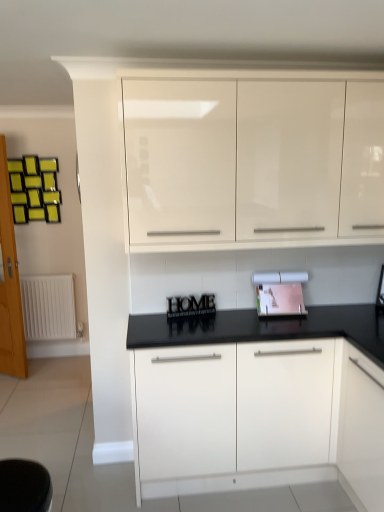
Question: Can you confirm if matte pink paper at center is taller than wooden glass door at left?

Choices:
 (A) no
 (B) yes

Answer: (A)

Question: Can you confirm if matte pink paper at center is bigger than wooden glass door at left?

Choices:
 (A) yes
 (B) no

Answer: (B)

Question: Can we say matte pink paper at center lies outside wooden glass door at left?

Choices:
 (A) yes
 (B) no

Answer: (A)

Question: From the image's perspective, is matte pink paper at center located beneath wooden glass door at left?

Choices:
 (A) no
 (B) yes

Answer: (B)

Question: Is matte pink paper at center thinner than wooden glass door at left?

Choices:
 (A) no
 (B) yes

Answer: (A)

Question: Considering their positions, is matte pink paper at center located in front of or behind wooden glass door at left?

Choices:
 (A) behind
 (B) front

Answer: (B)

Question: In terms of width, does matte pink paper at center look wider or thinner when compared to wooden glass door at left?

Choices:
 (A) thin
 (B) wide

Answer: (B)

Question: From the image's perspective, is matte pink paper at center located above or below wooden glass door at left?

Choices:
 (A) below
 (B) above

Answer: (A)

Question: Is matte pink paper at center taller or shorter than wooden glass door at left?

Choices:
 (A) short
 (B) tall

Answer: (A)

Question: Considering the positions of point (34, 285) and point (190, 92), is point (34, 285) closer or farther from the camera than point (190, 92)?

Choices:
 (A) closer
 (B) farther

Answer: (B)

Question: Is white matte radiator at left inside or outside of glossy white cabinets at upper center, the first cabinetry in the top-to-bottom sequence?

Choices:
 (A) inside
 (B) outside

Answer: (B)

Question: Considering their positions, is white matte radiator at left located in front of or behind glossy white cabinets at upper center, the second cabinetry in the bottom-to-top sequence?

Choices:
 (A) front
 (B) behind

Answer: (B)

Question: In terms of height, does white matte radiator at left look taller or shorter compared to glossy white cabinets at upper center, the first cabinetry in the top-to-bottom sequence?

Choices:
 (A) tall
 (B) short

Answer: (B)

Question: Considering the positions of white matte radiator at left and wooden letters at center in the image, is white matte radiator at left taller or shorter than wooden letters at center?

Choices:
 (A) tall
 (B) short

Answer: (A)

Question: From a real-world perspective, relative to wooden letters at center, is white matte radiator at left vertically above or below?

Choices:
 (A) below
 (B) above

Answer: (A)